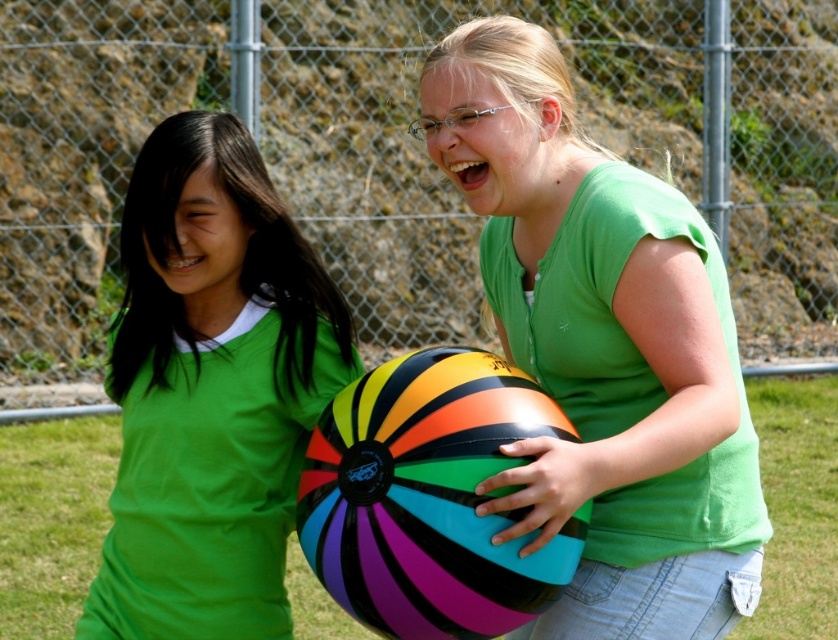
From the picture: Is rubberized multicolored ball at center above rainbow glossy beach ball at center?

Yes.

Does rubberized multicolored ball at center appear under rainbow glossy beach ball at center?

Actually, rubberized multicolored ball at center is above rainbow glossy beach ball at center.

At what (x,y) coordinates should I click in order to perform the action: click on rubberized multicolored ball at center. Please return your answer as a coordinate pair (x, y). This screenshot has width=838, height=640. Looking at the image, I should click on (603, 348).

Can you confirm if rubberized multicolored ball at center is bigger than green matte shirt at center?

Indeed, rubberized multicolored ball at center has a larger size compared to green matte shirt at center.

Which is behind, point (504, 472) or point (218, 490)?

The point (218, 490) is behind.

Describe the element at coordinates (603, 348) in the screenshot. I see `rubberized multicolored ball at center` at that location.

This screenshot has width=838, height=640. I want to click on rubberized multicolored ball at center, so click(x=603, y=348).

Which is in front, point (299, 429) or point (437, 595)?

Point (437, 595) is in front.

Who is more distant from viewer, (247, 580) or (376, 490)?

Point (247, 580)

The image size is (838, 640). In order to click on green matte shirt at center in this screenshot , I will do `click(210, 390)`.